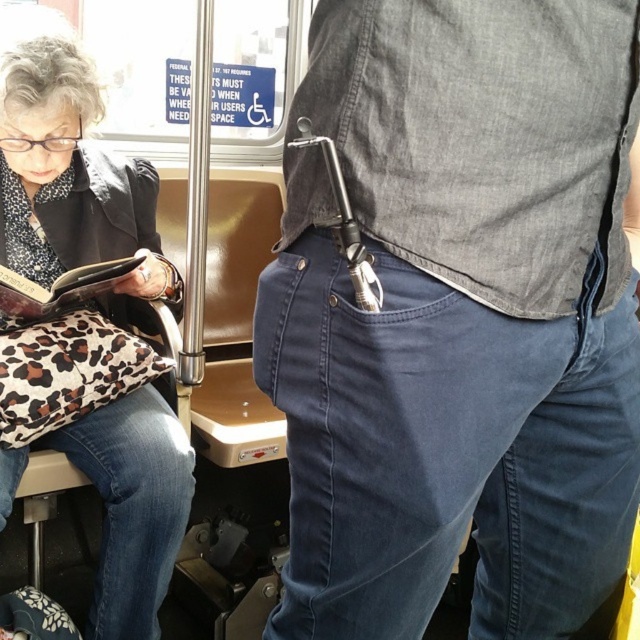
Question: Among these objects, which one is farthest from the camera?

Choices:
 (A) leopard print fabric book at left
 (B) leopard print fabric purse at lower left
 (C) metallic silver tool at center

Answer: (B)

Question: Estimate the real-world distances between objects in this image. Which object is closer to the leopard print fabric book at left?

Choices:
 (A) leopard print fabric purse at lower left
 (B) metallic silver tool at center

Answer: (A)

Question: Observing the image, what is the correct spatial positioning of leopard print fabric purse at lower left in reference to leopard print fabric book at left?

Choices:
 (A) above
 (B) below

Answer: (B)

Question: From the image, what is the correct spatial relationship of metallic silver tool at center in relation to leopard print fabric book at left?

Choices:
 (A) below
 (B) above

Answer: (A)

Question: Does metallic silver tool at center lie in front of leopard print fabric book at left?

Choices:
 (A) yes
 (B) no

Answer: (A)

Question: Which object is the closest to the leopard print fabric book at left?

Choices:
 (A) leopard print fabric purse at lower left
 (B) metallic silver tool at center

Answer: (A)